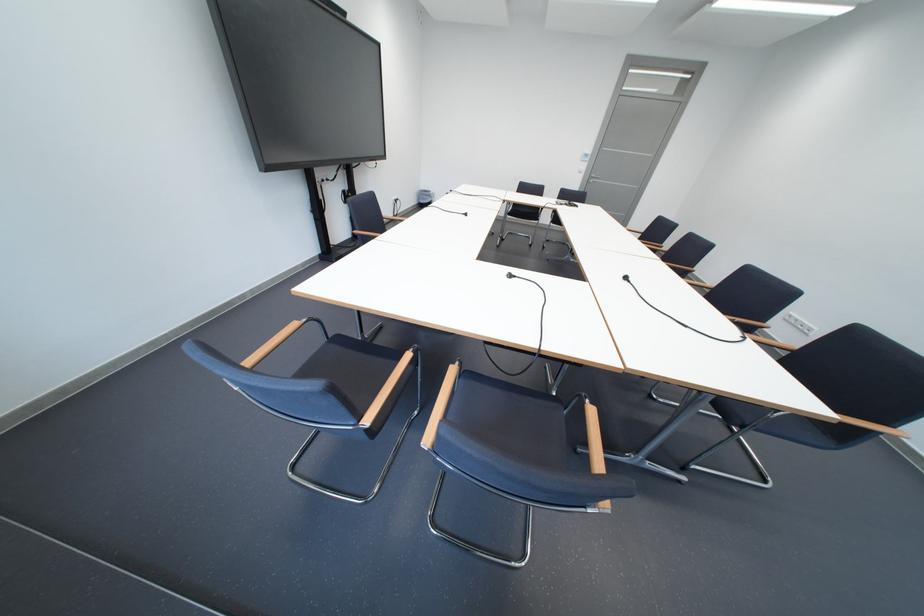
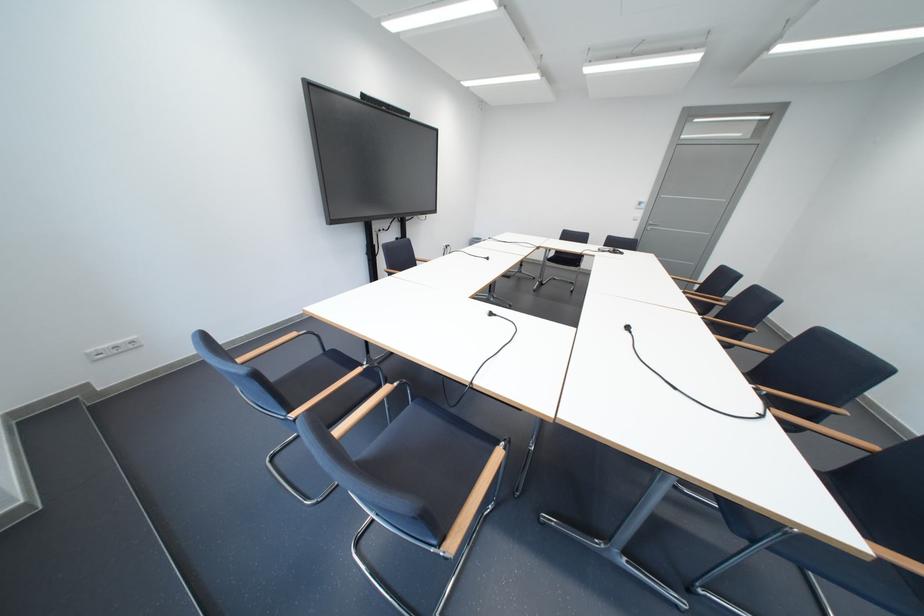
Locate, in the second image, the point that corresponds to point (523, 277) in the first image.

(503, 315)